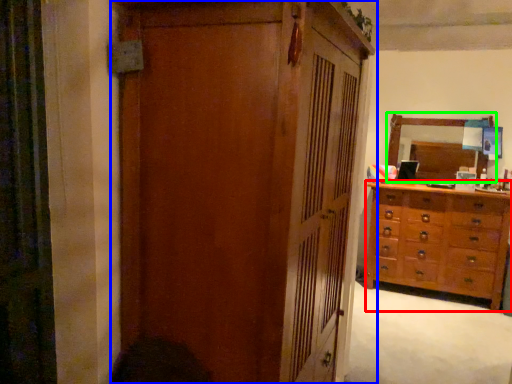
Question: Which object is the farthest from chest of drawers (highlighted by a red box)? Choose among these: cupboard (highlighted by a blue box) or mirror (highlighted by a green box).

Choices:
 (A) cupboard
 (B) mirror

Answer: (A)